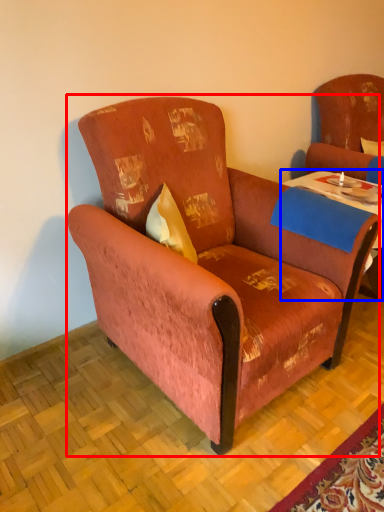
Question: Which object is closer to the camera taking this photo, chair (highlighted by a red box) or table (highlighted by a blue box)?

Choices:
 (A) chair
 (B) table

Answer: (A)